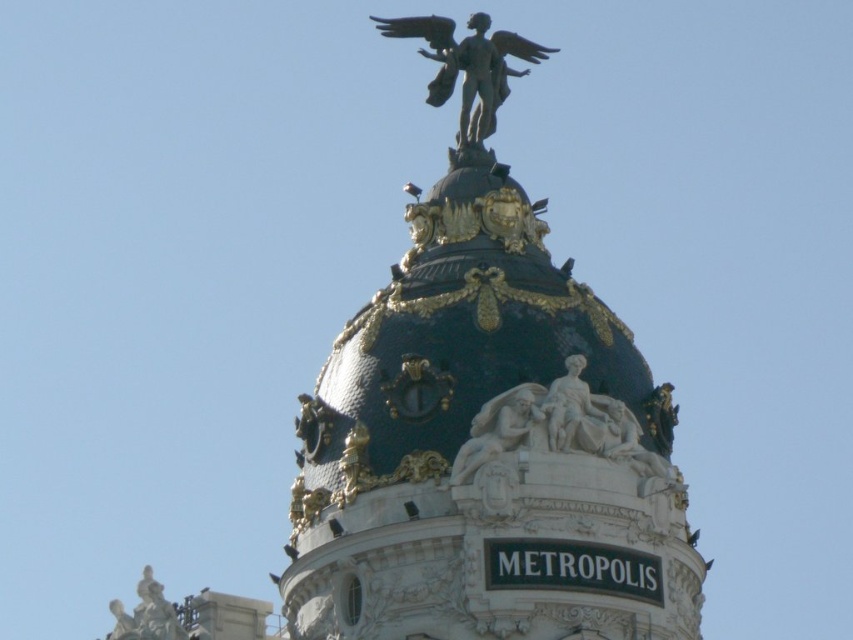
You are standing at the base of the Metropolis Building in Madrid, Spain. You want to take a photo of the white marble statue at center from a distance that allows the statue to be clearly visible without appearing too small. Considering the statue is 93.46 meters away from your current position, is this distance suitable for capturing a clear, detailed image?

The white marble statue at center is 93.46 meters away from the camera. This distance may be too far to capture clear details of the statue in a photo without specialized equipment like a telephoto lens. A closer position would likely provide better clarity and detail.

You are an art conservator examining the Metropolis Building in Madrid. You notice two bronze statues on the dome. The polished bronze statue at upper center and the bronze statue at lower left. Which one is positioned higher up?

The polished bronze statue at upper center is positioned higher up than the bronze statue at lower left.

You are an architect analyzing the dome of the Metropolis Building. You observe two points on the dome structure at coordinates point (451, 404) and point (595, 452). Which point is closer to you when viewed from the front?

Point (451, 404) is closer to you than point (595, 452) because it is further to the viewer.